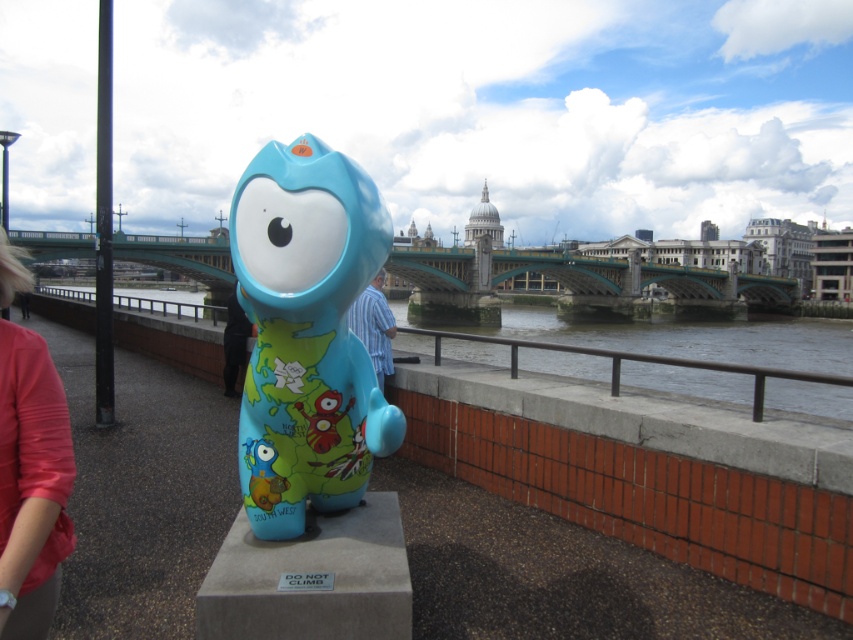
You are a visitor at the riverside walkway and want to take a photo of the matte plastic sculpture at center and the matte blue statue at center. Since you want to ensure both are visible in the frame, which one should you focus on to include both?

You should focus on the matte blue statue at center because it is positioned under the matte plastic sculpture at center, so by focusing on the lower one, both will be in the frame.

You are a photographer standing at the riverside walkway. You want to take a photo of the blue striped shirt at center and the matte blue statue at center. Which object should you focus on first if you want to capture both in the same frame without moving the camera?

The blue striped shirt at center is located above the matte blue statue at center, so you should focus on the blue striped shirt at center first to ensure both are in the same frame.

Consider the image. You are a photographer trying to capture a photo of both the blue striped shirt at center and the matte blue statue at center in the same frame. Given that your camera can only focus on objects within a 3 meter width, will both objects fit in the frame?

The blue striped shirt at center has a lesser width compared to matte blue statue at center. However, the total combined width of both objects would need to be within 3 meters to fit in the frame. Since the exact widths aren